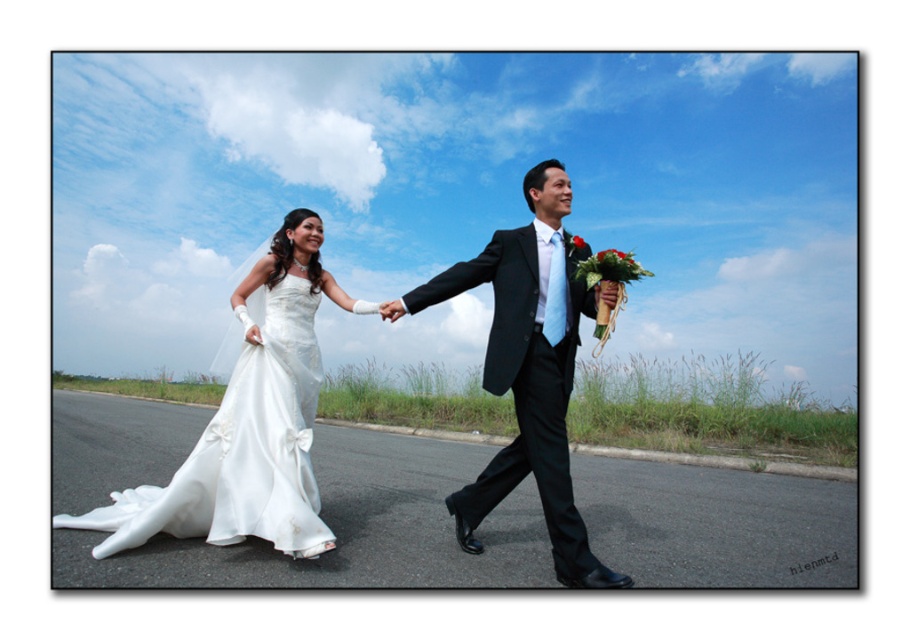
Question: Which point is farther from the camera taking this photo?

Choices:
 (A) (238, 422)
 (B) (553, 161)
 (C) (258, 500)

Answer: (A)

Question: Is white satin dress at left to the left of matte black suit at center from the viewer's perspective?

Choices:
 (A) no
 (B) yes

Answer: (B)

Question: Which object appears farthest from the camera in this image?

Choices:
 (A) matte black suit at center
 (B) satin white gown at left

Answer: (B)

Question: Does satin white gown at left appear on the left side of matte black suit at center?

Choices:
 (A) yes
 (B) no

Answer: (A)

Question: Which point appears closest to the camera in this image?

Choices:
 (A) (278, 513)
 (B) (205, 474)

Answer: (A)

Question: Observing the image, what is the correct spatial positioning of white satin dress at left in reference to matte black suit at center?

Choices:
 (A) below
 (B) above

Answer: (A)